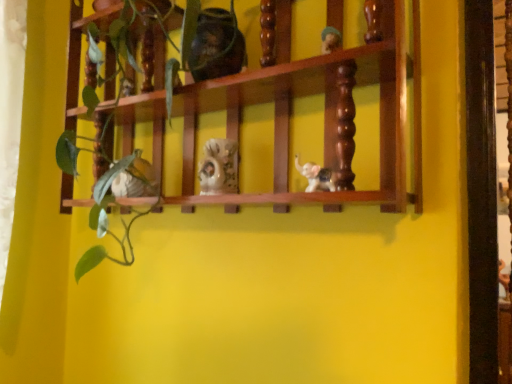
Question: Which direction should I rotate to face matte ceramic elephant at center, which is the 1th toy from bottom to top, — up or down?

Choices:
 (A) up
 (B) down

Answer: (A)

Question: Which direction should I rotate to look at matte brown vase at upper center, which is the 4th toy from bottom to top?

Choices:
 (A) left
 (B) right

Answer: (A)

Question: Can you confirm if matte brown vase at upper center, which ranks as the second toy in left-to-right order, is smaller than porcelain figurine at center, which is the 2th toy from top to bottom?

Choices:
 (A) no
 (B) yes

Answer: (A)

Question: Is matte brown vase at upper center, which is the 4th toy from bottom to top, behind porcelain figurine at center, which is the third toy in left-to-right order?

Choices:
 (A) no
 (B) yes

Answer: (A)

Question: Considering the relative sizes of matte brown vase at upper center, which is the 4th toy from bottom to top, and porcelain figurine at center, which is the 2th toy from top to bottom, in the image provided, is matte brown vase at upper center, which is the 4th toy from bottom to top, bigger than porcelain figurine at center, which is the 2th toy from top to bottom,?

Choices:
 (A) no
 (B) yes

Answer: (B)

Question: Can you confirm if matte brown vase at upper center, the third toy in the right-to-left sequence, is taller than porcelain figurine at center, which is the third toy in left-to-right order?

Choices:
 (A) yes
 (B) no

Answer: (A)

Question: Can you confirm if matte brown vase at upper center, which ranks as the second toy in left-to-right order, is positioned to the left of porcelain figurine at center, which is the third toy in bottom-to-top order?

Choices:
 (A) yes
 (B) no

Answer: (A)

Question: From a real-world perspective, does matte brown vase at upper center, the third toy in the right-to-left sequence, sit lower than porcelain figurine at center, which is the third toy in left-to-right order?

Choices:
 (A) no
 (B) yes

Answer: (A)

Question: Can you confirm if matte ceramic elephant at center, the 1th toy in the right-to-left sequence, is positioned to the left of matte ceramic elephant at center, the second toy positioned from the bottom?

Choices:
 (A) yes
 (B) no

Answer: (B)

Question: Does matte ceramic elephant at center, the 1th toy in the right-to-left sequence, come behind matte ceramic elephant at center, the second toy positioned from the bottom?

Choices:
 (A) yes
 (B) no

Answer: (B)

Question: Can you confirm if matte ceramic elephant at center, the 1th toy in the right-to-left sequence, is bigger than matte ceramic elephant at center, which appears as the 1th toy when viewed from the left?

Choices:
 (A) yes
 (B) no

Answer: (B)

Question: Is matte ceramic elephant at center, which appears as the 1th toy when viewed from the left, a part of matte ceramic elephant at center, the fourth toy from the top?

Choices:
 (A) yes
 (B) no

Answer: (B)

Question: From the image's perspective, would you say matte ceramic elephant at center, which is the 1th toy from bottom to top, is shown under matte ceramic elephant at center, which ranks as the 3th toy in top-to-bottom order?

Choices:
 (A) yes
 (B) no

Answer: (A)

Question: Considering the relative sizes of matte ceramic elephant at center, which is the 1th toy from bottom to top, and matte ceramic elephant at center, which appears as the 1th toy when viewed from the left, in the image provided, is matte ceramic elephant at center, which is the 1th toy from bottom to top, wider than matte ceramic elephant at center, which appears as the 1th toy when viewed from the left,?

Choices:
 (A) yes
 (B) no

Answer: (B)

Question: Is matte ceramic elephant at center, the fourth toy from the top, positioned in front of porcelain figurine at center, which ranks as the second toy in right-to-left order?

Choices:
 (A) no
 (B) yes

Answer: (B)